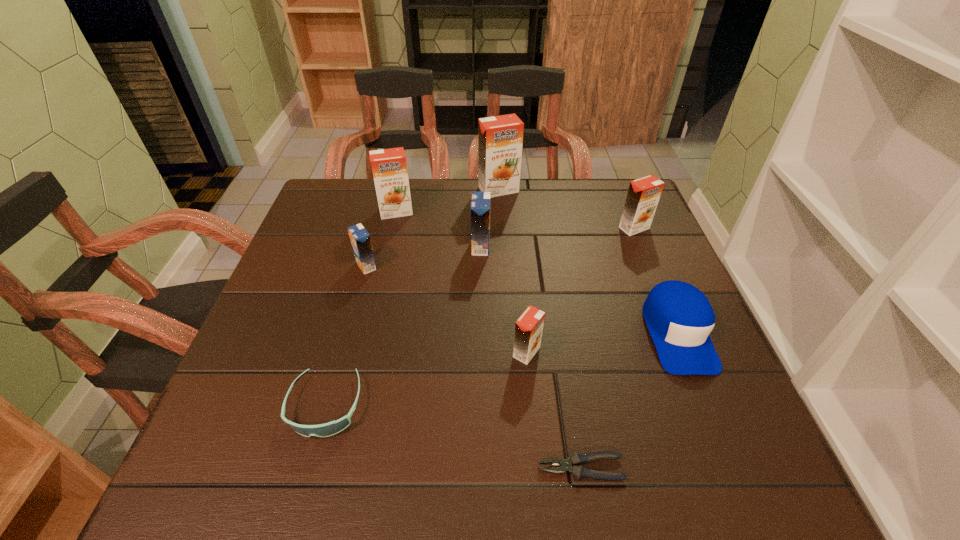
Image resolution: width=960 pixels, height=540 pixels. I want to click on the nearest orange orange juice, so click(528, 328).

You are a GUI agent. You are given a task and a screenshot of the screen. Output one action in this format:
    pyautogui.click(x=<x>, y=<y>)
    Task: Click on the smallest orange orange juice
    
    Given the screenshot: What is the action you would take?
    pyautogui.click(x=528, y=328)

Where is `baseball cap`? baseball cap is located at coordinates (679, 317).

You are a GUI agent. You are given a task and a screenshot of the screen. Output one action in this format:
    pyautogui.click(x=<x>, y=<y>)
    Task: Click on the blue baseball cap
    This screenshot has height=540, width=960.
    Given the screenshot: What is the action you would take?
    pyautogui.click(x=679, y=317)

Find the location of a particular element. This screenshot has height=540, width=960. goggles is located at coordinates (331, 428).

The width and height of the screenshot is (960, 540). What are the coordinates of `the shortest object` in the screenshot? It's located at (575, 460).

This screenshot has width=960, height=540. What are the coordinates of `gray pliers` in the screenshot? It's located at (575, 460).

You are a GUI agent. You are given a task and a screenshot of the screen. Output one action in this format:
    pyautogui.click(x=<x>, y=<y>)
    Task: Click on the free spot located 0.350m on the right of the biggest orange orange juice
    The height and width of the screenshot is (540, 960).
    Given the screenshot: What is the action you would take?
    pyautogui.click(x=636, y=190)

The image size is (960, 540). Find the location of `vacant space situated 0.050m on the right of the leftmost orange orange juice`. vacant space situated 0.050m on the right of the leftmost orange orange juice is located at coordinates (431, 212).

This screenshot has height=540, width=960. Identify the location of blank space located on the left of the right blue orange_juice. (374, 247).